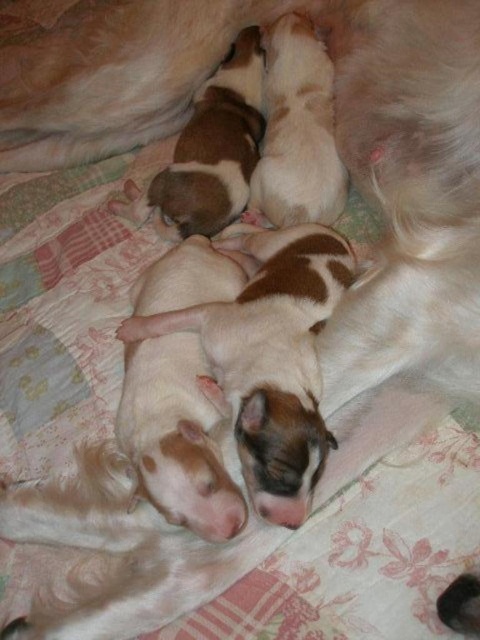
Question: Which of the following is the farthest from the observer?

Choices:
 (A) white fur puppies at center
 (B) brown and white fur at center

Answer: (B)

Question: Where is white fur puppies at center located in relation to brown and white fur at center in the image?

Choices:
 (A) above
 (B) below

Answer: (B)

Question: Which object appears farthest from the camera in this image?

Choices:
 (A) brown and white fur at center
 (B) white fur puppies at center

Answer: (A)

Question: Can you confirm if white fur puppies at center is positioned to the left of brown and white fur at center?

Choices:
 (A) yes
 (B) no

Answer: (B)

Question: Is white fur puppies at center further to the viewer compared to brown and white fur at center?

Choices:
 (A) yes
 (B) no

Answer: (B)